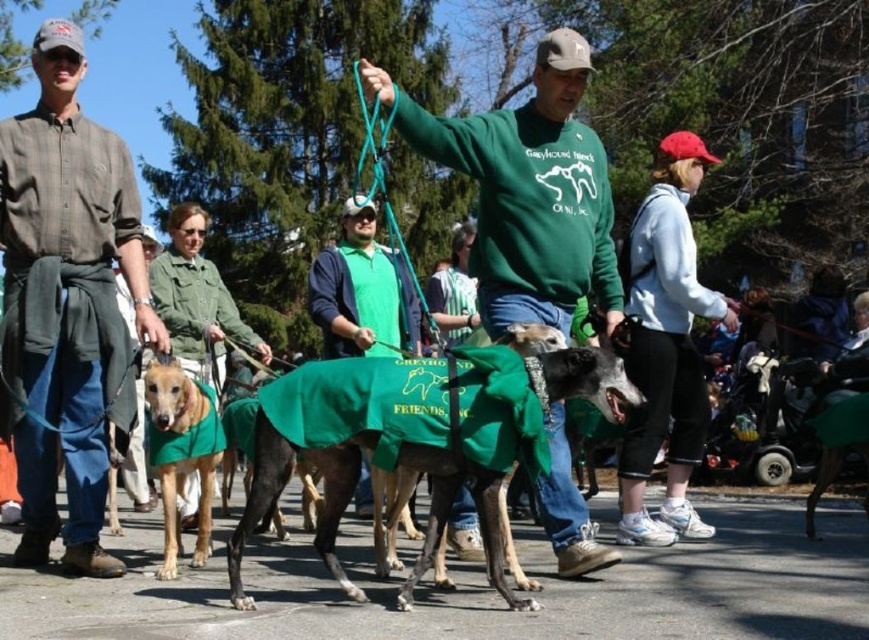
Between green fleece vest at center and green fabric jacket at center, which one is positioned lower?

green fleece vest at center

Can you confirm if green fleece vest at center is thinner than green fabric jacket at center?

Indeed, green fleece vest at center has a lesser width compared to green fabric jacket at center.

Which is in front, point (360, 515) or point (156, 289)?

Point (156, 289)

Image resolution: width=869 pixels, height=640 pixels. I want to click on green fleece vest at center, so click(x=362, y=291).

Does plaid shirt at left appear on the left side of green fleece sweatshirt at center?

Correct, you'll find plaid shirt at left to the left of green fleece sweatshirt at center.

Which is more to the right, plaid shirt at left or green fleece sweatshirt at center?

From the viewer's perspective, green fleece sweatshirt at center appears more on the right side.

Where is `plaid shirt at left`? The image size is (869, 640). plaid shirt at left is located at coordinates (67, 304).

Is point (478, 371) positioned after point (204, 320)?

No, (478, 371) is in front of (204, 320).

Measure the distance between point [523,362] and camera.

Point [523,362] is 33.76 feet from camera.

Identify the location of green fabric-covered dog at center. This screenshot has width=869, height=640. (413, 438).

Find the location of a particular element. green fabric-covered dog at center is located at coordinates (413, 438).